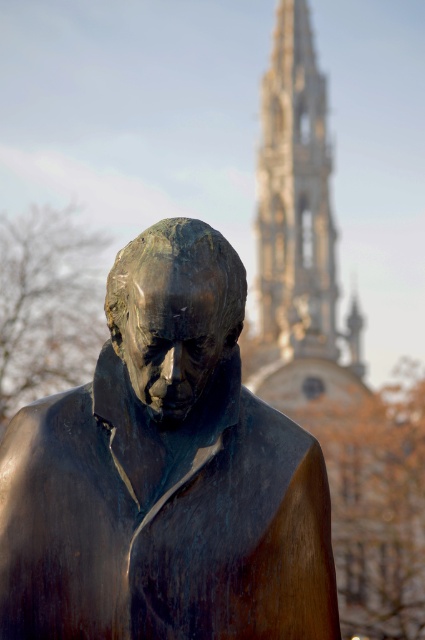
Question: Is bronze statue at center in front of white stone tower at upper center?

Choices:
 (A) no
 (B) yes

Answer: (B)

Question: Can you confirm if bronze statue at center is wider than white stone tower at upper center?

Choices:
 (A) yes
 (B) no

Answer: (B)

Question: Which object is closer to the camera taking this photo?

Choices:
 (A) bronze statue at center
 (B) white stone tower at upper center

Answer: (A)

Question: Can you confirm if bronze statue at center is smaller than white stone tower at upper center?

Choices:
 (A) no
 (B) yes

Answer: (B)

Question: Which object is farther from the camera taking this photo?

Choices:
 (A) white stone tower at upper center
 (B) bronze statue at center

Answer: (A)